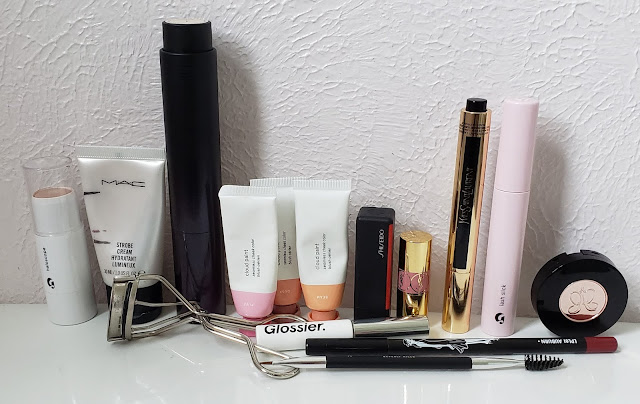
The image size is (640, 404). Find the location of `11 makeups`. 11 makeups is located at coordinates (474, 256).